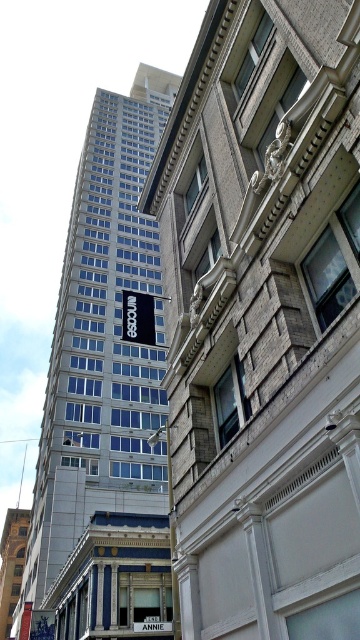
Does black matte sign at upper center have a greater width compared to white plastic sign at center?

Indeed, black matte sign at upper center has a greater width compared to white plastic sign at center.

Does point (141, 324) lie behind point (144, 627)?

No, (141, 324) is in front of (144, 627).

Between point (142, 316) and point (145, 620), which one is positioned in front?

Positioned in front is point (142, 316).

Find the location of a particular element. Image resolution: width=360 pixels, height=640 pixels. black matte sign at upper center is located at coordinates (137, 317).

In the scene shown: Can you confirm if metallic pole at center is bigger than white plastic sign at center?

Correct, metallic pole at center is larger in size than white plastic sign at center.

Between point (176, 589) and point (168, 632), which one is positioned in front?

Point (176, 589) is in front.

Find the location of a particular element. The image size is (360, 640). metallic pole at center is located at coordinates pos(172,541).

Is black matte sign at upper center shorter than metallic pole at center?

Yes, black matte sign at upper center is shorter than metallic pole at center.

Does black matte sign at upper center have a larger size compared to metallic pole at center?

No, black matte sign at upper center is not bigger than metallic pole at center.

I want to click on black matte sign at upper center, so click(x=137, y=317).